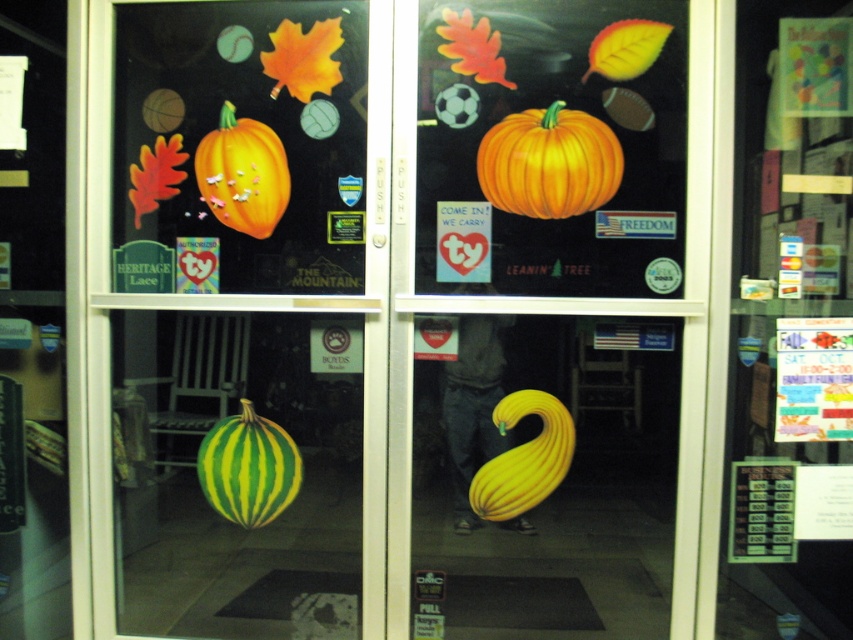
You are standing in front of the glass doors described. You want to place a new sticker of a sunflower exactly 2 inches to the right and 1 inch below the orange matte pumpkin at upper center. Where should you place the sunflower sticker?

The orange matte pumpkin at upper center is located at point (556, 321). To place the sunflower sticker 2 inches to the right and 1 inch below, you would adjust the coordinates accordingly. However, without knowing the coordinate system scale, it is impossible to determine the exact placement. Please provide the scale of the coordinate system to calculate the precise location.

You are trying to hang a new sticker between the green striped pumpkin at lower left and the matte orange pumpkin at upper left on the glass door. If your sticker is 12 inches wide, will there be enough space?

The distance between the green striped pumpkin at lower left and the matte orange pumpkin at upper left is 28.49 inches, so a 12 inch wide sticker can fit between them since 12 is less than 28.49.